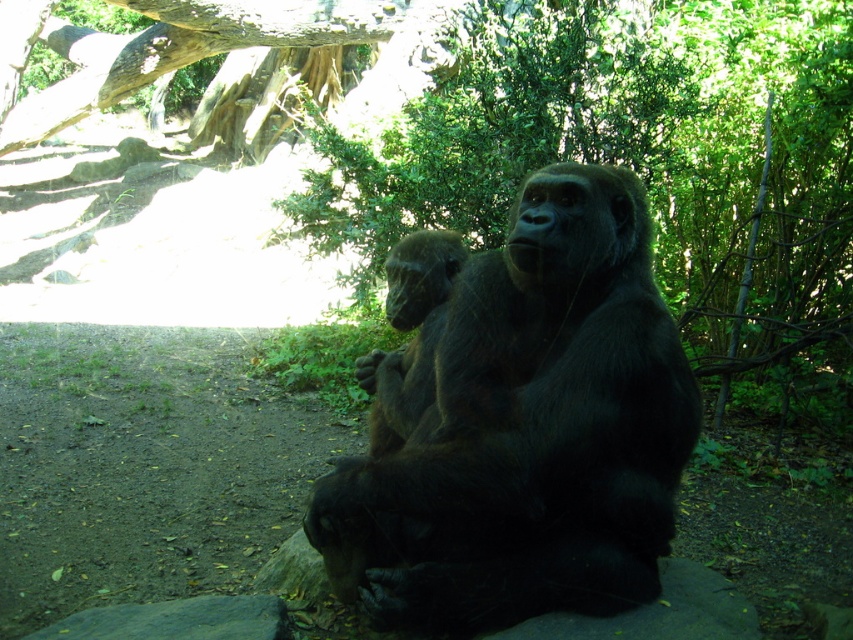
Question: Which object appears farthest from the camera in this image?

Choices:
 (A) green leafy tree at upper center
 (B) rough bark tree trunk at upper left

Answer: (B)

Question: Considering the relative positions of green leafy tree at upper center and dark brown fur gorilla at center in the image provided, where is green leafy tree at upper center located with respect to dark brown fur gorilla at center?

Choices:
 (A) right
 (B) left

Answer: (A)

Question: Is green leafy tree at upper center positioned in front of rough bark tree trunk at upper left?

Choices:
 (A) yes
 (B) no

Answer: (A)

Question: Which is nearer to the green leafy tree at upper center?

Choices:
 (A) rough bark tree trunk at upper left
 (B) dark brown fur gorilla at center

Answer: (B)

Question: Is green leafy tree at upper center positioned in front of rough bark tree trunk at upper left?

Choices:
 (A) no
 (B) yes

Answer: (B)

Question: Which of the following is the farthest from the observer?

Choices:
 (A) (426, 577)
 (B) (165, 20)
 (C) (477, 193)

Answer: (B)